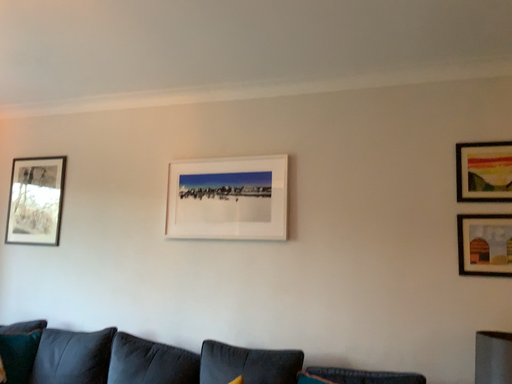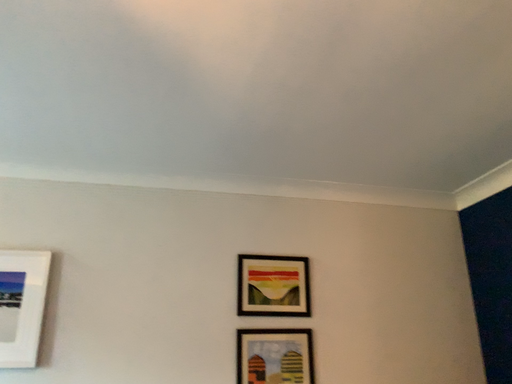
Question: How did the camera likely rotate when shooting the video?

Choices:
 (A) rotated upward
 (B) rotated downward

Answer: (A)